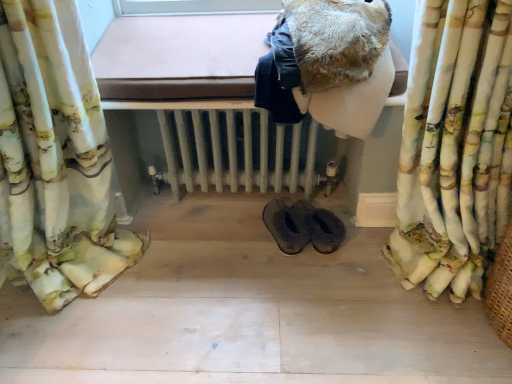
Identify the location of empty space that is to the right of black leather slippers at center. This screenshot has height=384, width=512. coord(367,251).